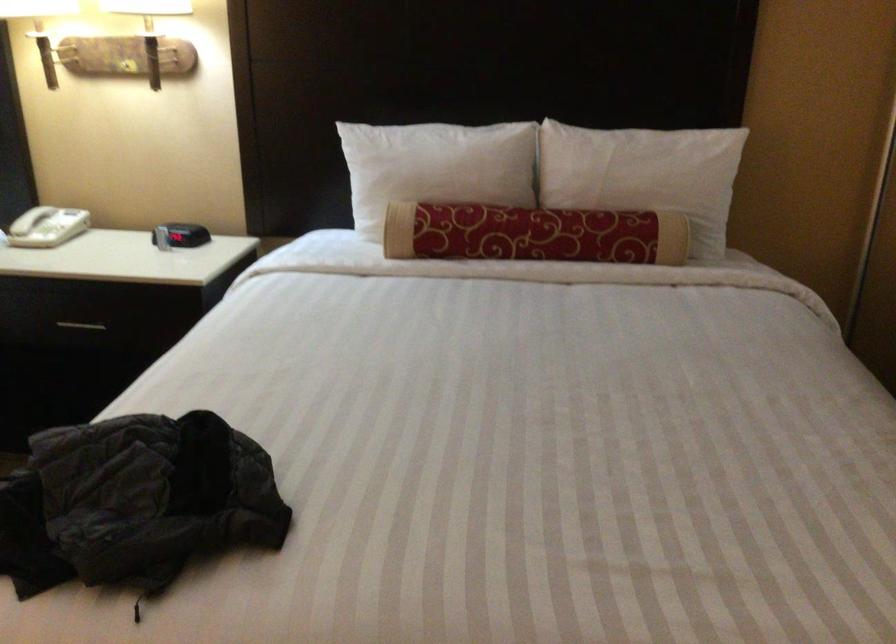
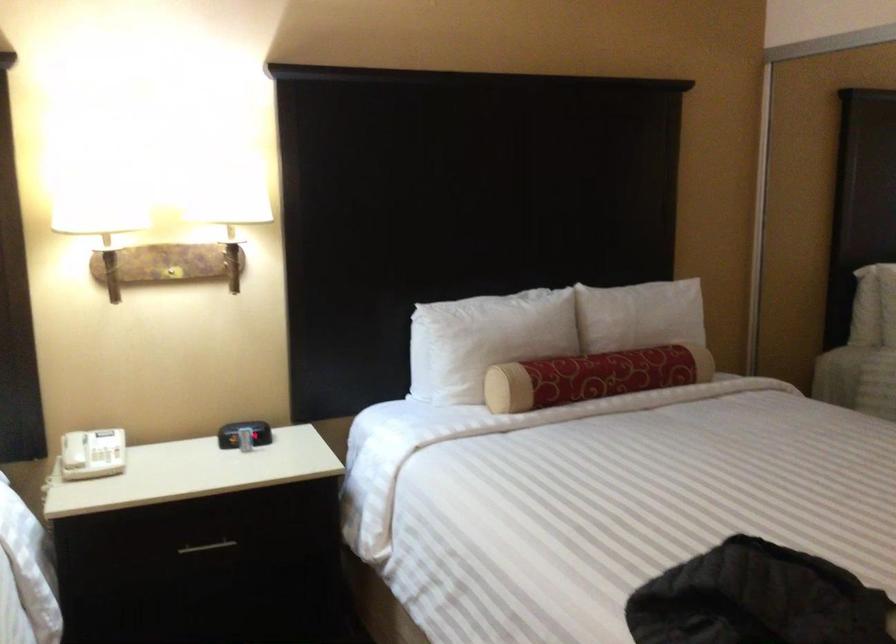
In the second image, find the point that corresponds to (x=495, y=234) in the first image.

(592, 377)